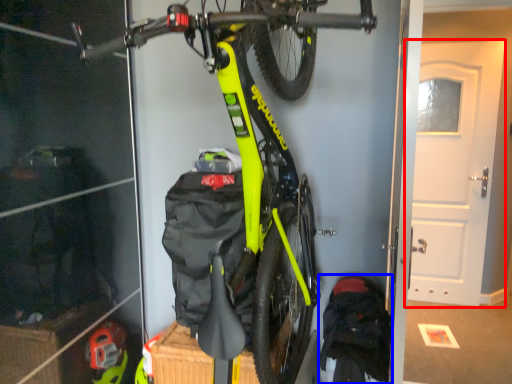
Question: Which of the following is the closest to the observer, door (highlighted by a red box) or backpack (highlighted by a blue box)?

Choices:
 (A) door
 (B) backpack

Answer: (B)